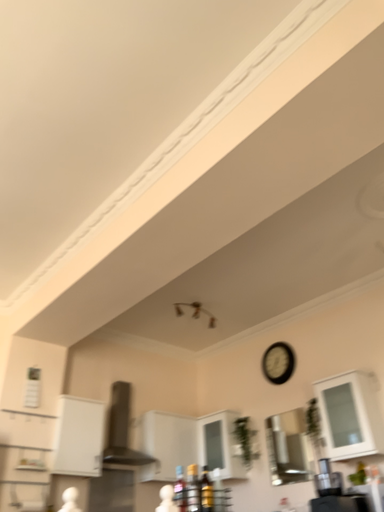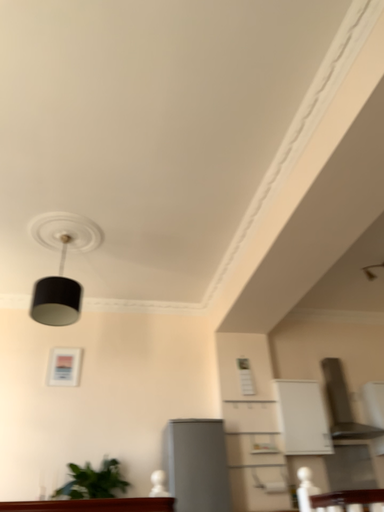
Question: Which way did the camera rotate in the video?

Choices:
 (A) rotated left
 (B) rotated right

Answer: (A)